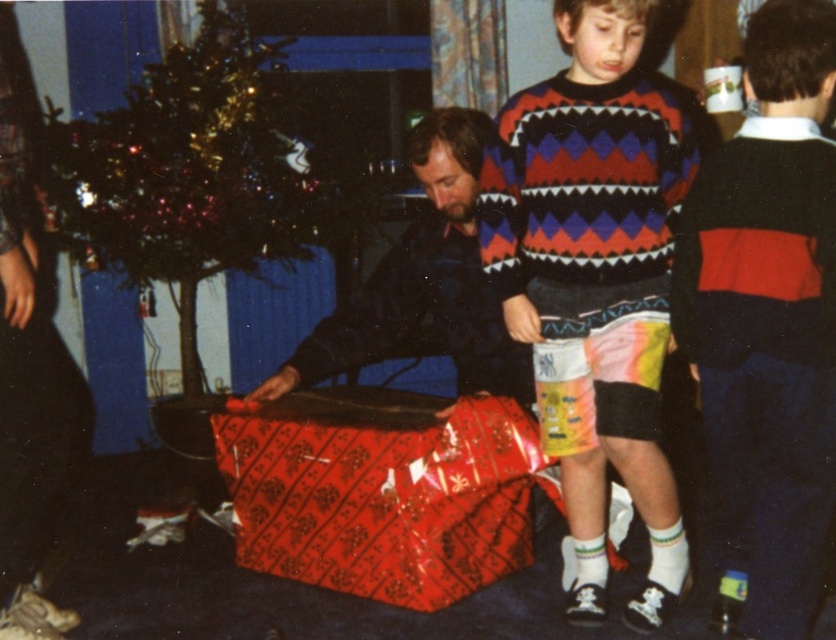
Question: Which is nearer to the knitted sweater at center?

Choices:
 (A) red sweater at center
 (B) dark blue sweater at center

Answer: (A)

Question: Can you confirm if red sweater at center is thinner than shiny green christmas tree at left?

Choices:
 (A) no
 (B) yes

Answer: (B)

Question: Which object is closer to the camera taking this photo?

Choices:
 (A) dark blue sweater at center
 (B) red sweater at center

Answer: (B)

Question: Is knitted sweater at center further to camera compared to red sweater at center?

Choices:
 (A) no
 (B) yes

Answer: (B)

Question: Which of the following is the closest to the observer?

Choices:
 (A) (227, 253)
 (B) (477, 364)
 (C) (617, 412)

Answer: (C)

Question: Is knitted sweater at center above shiny green christmas tree at left?

Choices:
 (A) no
 (B) yes

Answer: (A)